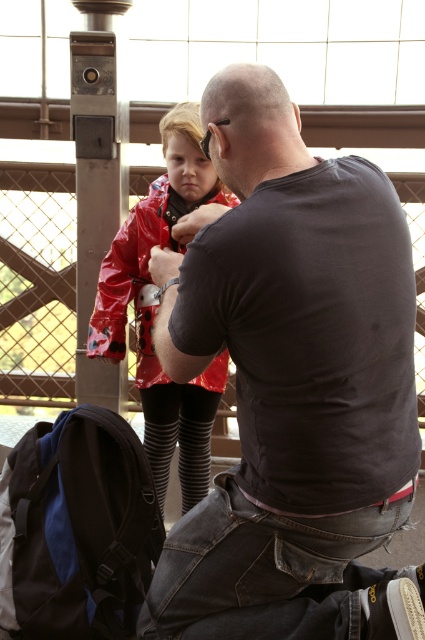
Question: Does dark gray t-shirt at center lie in front of shiny red jacket at center?

Choices:
 (A) no
 (B) yes

Answer: (B)

Question: Is dark gray t-shirt at center bigger than shiny red jacket at center?

Choices:
 (A) yes
 (B) no

Answer: (A)

Question: Can you confirm if dark gray t-shirt at center is positioned above shiny red jacket at center?

Choices:
 (A) yes
 (B) no

Answer: (B)

Question: Which point is closer to the camera?

Choices:
 (A) shiny red jacket at center
 (B) dark gray t-shirt at center

Answer: (B)